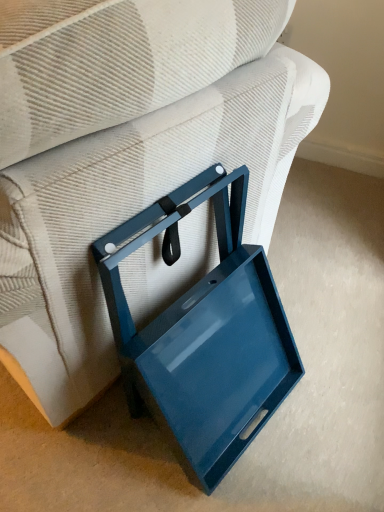
Question: Considering the positions of glossy blue tray at lower right and glossy blue tray at lower center in the image, is glossy blue tray at lower right wider or thinner than glossy blue tray at lower center?

Choices:
 (A) wide
 (B) thin

Answer: (A)

Question: Does point (77, 93) appear closer or farther from the camera than point (243, 448)?

Choices:
 (A) farther
 (B) closer

Answer: (B)

Question: Considering the positions of glossy blue tray at lower right and glossy blue tray at lower center in the image, is glossy blue tray at lower right bigger or smaller than glossy blue tray at lower center?

Choices:
 (A) small
 (B) big

Answer: (B)

Question: Do you think glossy blue tray at lower center is within glossy blue tray at lower right, or outside of it?

Choices:
 (A) inside
 (B) outside

Answer: (B)

Question: Considering the positions of point (195, 437) and point (125, 131), is point (195, 437) closer or farther from the camera than point (125, 131)?

Choices:
 (A) farther
 (B) closer

Answer: (A)

Question: Considering the positions of glossy blue tray at lower center and glossy blue tray at lower right in the image, is glossy blue tray at lower center taller or shorter than glossy blue tray at lower right?

Choices:
 (A) short
 (B) tall

Answer: (A)

Question: From a real-world perspective, is glossy blue tray at lower center positioned above or below glossy blue tray at lower right?

Choices:
 (A) above
 (B) below

Answer: (B)